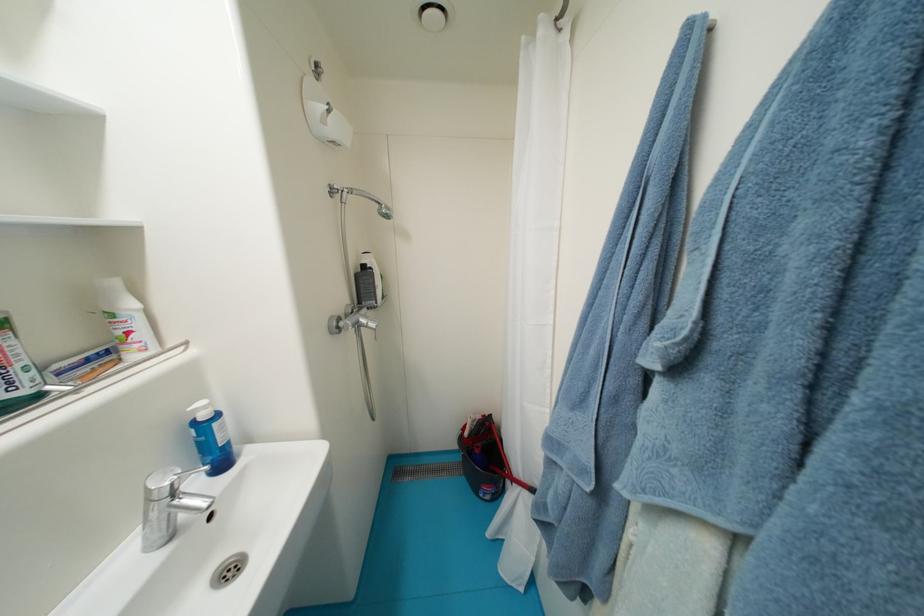
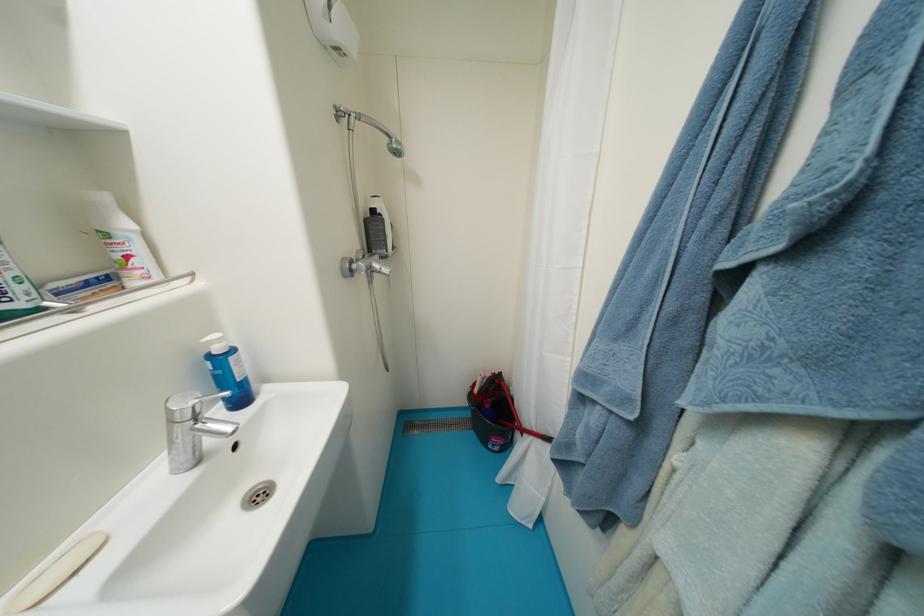
The point at [469,480] is marked in the first image. Where is the corresponding point in the second image?

(479, 435)